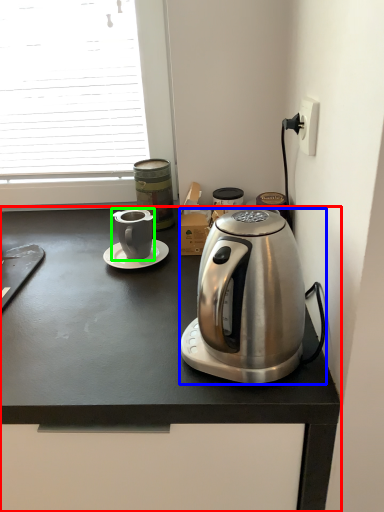
Question: Considering the real-world distances, which object is closest to desk (highlighted by a red box)? coffee maker (highlighted by a blue box) or coffee cup (highlighted by a green box).

Choices:
 (A) coffee maker
 (B) coffee cup

Answer: (A)